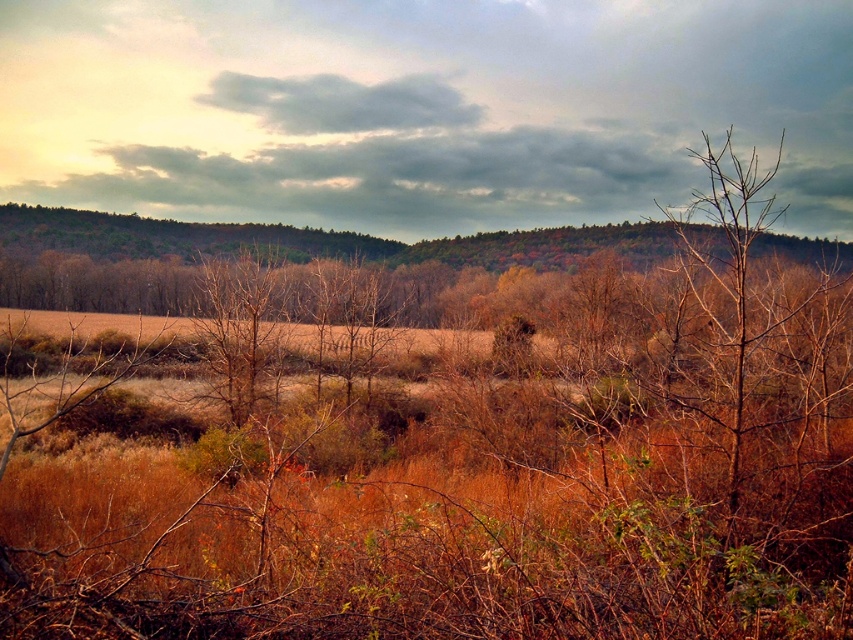
You are standing in the serene landscape scene described. If you were to walk directly towards the dense line of trees on the horizon, would you encounter the bare branches at right before reaching the trees?

The bare branches at right are located at coordinates point [733,269], which places them closer to the viewer than the dense line of trees on the horizon. Therefore, you would encounter the bare branches at right before reaching the trees.

You are a bird looking for a place to perch. You see the bare branches at right and the brown dry tree at center. Which one is located to the right of the other?

The bare branches at right is positioned on the right side of brown dry tree at center.

You are an artist trying to paint the landscape. You want to ensure the proportions between the bare branches at right and the brown dry tree at center are accurate. Which one should you draw taller in your painting?

The bare branches at right should be drawn taller than the brown dry tree at center because the description states that the bare branches at right has a greater height compared to brown dry tree at center.